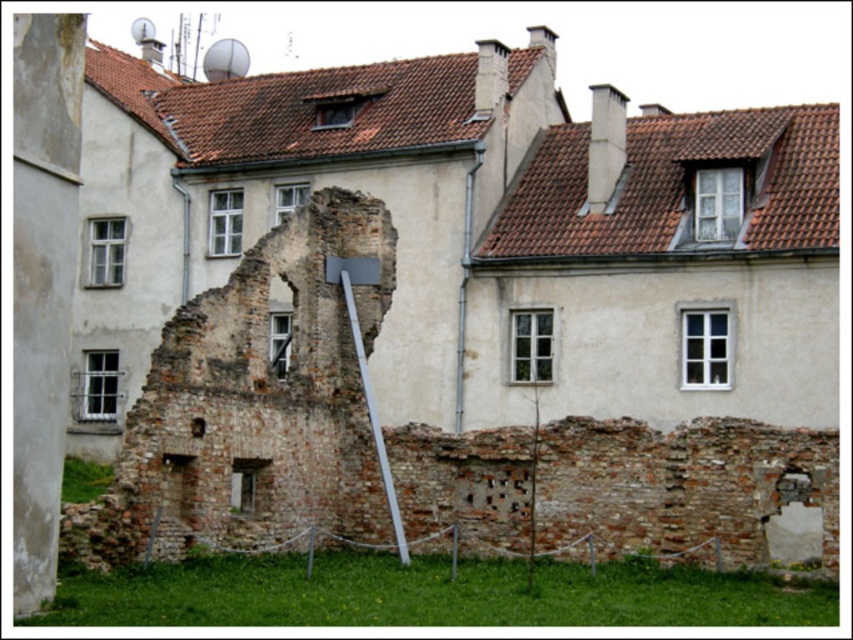
You are standing in front of the historical building and notice a brick wall at center and a white metallic pole at center. Which object is positioned to the right of the other?

The brick wall at center is to the right of the white metallic pole at center according to the description.

You are a construction worker assessing the stability of the brick wall at center and the white metallic pole at center. Based on their positions, which object is more likely to be supporting the upper structure?

The brick wall at center is above the white metallic pole at center, so the pole is more likely supporting the upper structure, including the wall.